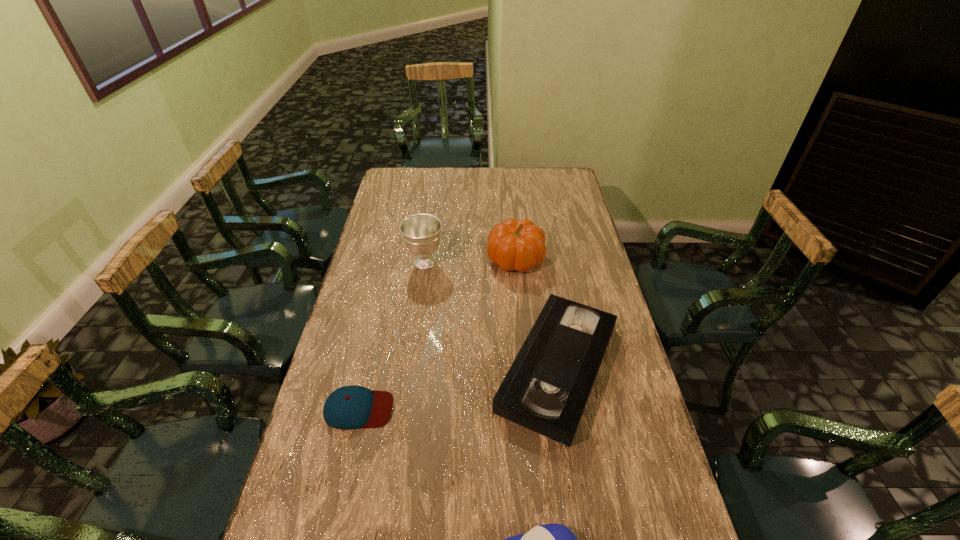
Where is `chalice`? Image resolution: width=960 pixels, height=540 pixels. chalice is located at coordinates (421, 233).

Identify the location of pumpkin. (519, 245).

You are a GUI agent. You are given a task and a screenshot of the screen. Output one action in this format:
    pyautogui.click(x=<x>, y=<y>)
    Task: Click on the videotape
    Image resolution: width=960 pixels, height=540 pixels.
    Given the screenshot: What is the action you would take?
    546,389

Where is `the left baseball cap`? This screenshot has height=540, width=960. the left baseball cap is located at coordinates (349, 407).

Where is `the farther baseball cap`? The height and width of the screenshot is (540, 960). the farther baseball cap is located at coordinates (349, 407).

Locate an element on the screen. vacant area situated 0.200m on the back of the chalice is located at coordinates coord(431,221).

Find the location of `vacant position located 0.180m on the left of the pumpkin`. vacant position located 0.180m on the left of the pumpkin is located at coordinates (440, 259).

Locate an element on the screen. free space located 0.270m on the back of the videotape is located at coordinates (540, 258).

The image size is (960, 540). Identify the location of free location located 0.210m with the bill of the shorter baseball cap facing forward. (468, 409).

You are a GUI agent. You are given a task and a screenshot of the screen. Output one action in this format:
    pyautogui.click(x=<x>, y=<y>)
    Task: Click on the object at the left edge
    This screenshot has width=960, height=540.
    Given the screenshot: What is the action you would take?
    pyautogui.click(x=349, y=407)